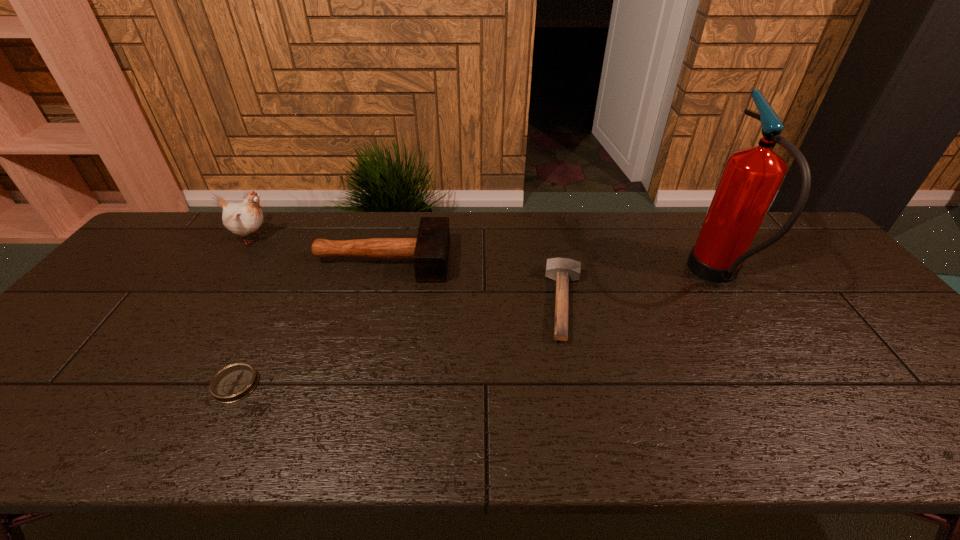
Find the location of a particular element. The image size is (960, 540). vacant region located 0.100m on the right of the tallest object is located at coordinates (777, 276).

The width and height of the screenshot is (960, 540). In order to click on free space located 0.200m at the beak of the leftmost object in this screenshot , I will do click(x=337, y=237).

At what (x,y) coordinates should I click in order to perform the action: click on vacant space located on the hammer head face of the third object from left to right. Please return your answer as a coordinate pair (x, y). This screenshot has height=540, width=960. Looking at the image, I should click on (492, 260).

Identify the location of vacant point located on the right of the second object from right to left. (679, 303).

Image resolution: width=960 pixels, height=540 pixels. I want to click on free space located 0.080m on the front of the fourth object from right to left, so click(x=209, y=438).

At what (x,y) coordinates should I click in order to perform the action: click on fire extinguisher positioned at the far edge. Please return your answer as a coordinate pair (x, y). This screenshot has width=960, height=540. Looking at the image, I should click on (752, 176).

At what (x,y) coordinates should I click in order to perform the action: click on bird that is at the far edge. Please return your answer as a coordinate pair (x, y). Looking at the image, I should click on (244, 218).

Locate an element on the screen. This screenshot has height=540, width=960. mallet that is at the far edge is located at coordinates (430, 250).

The image size is (960, 540). Find the location of `vacant space at the far edge`. vacant space at the far edge is located at coordinates (679, 248).

This screenshot has height=540, width=960. I want to click on free space at the near edge, so click(911, 428).